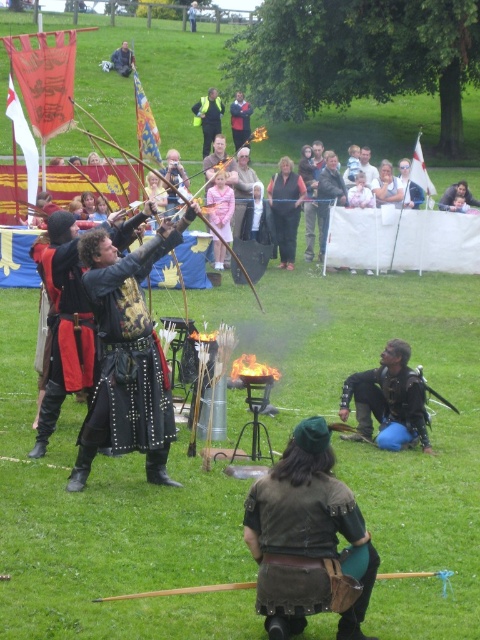
Question: Does yellow reflective vest at center have a larger size compared to smooth leather jacket at upper center?

Choices:
 (A) no
 (B) yes

Answer: (A)

Question: Does black leather armor at center appear over yellow reflective vest at center?

Choices:
 (A) no
 (B) yes

Answer: (A)

Question: Is dark brown leather jacket at center above smooth leather jacket at upper center?

Choices:
 (A) no
 (B) yes

Answer: (A)

Question: Among these points, which one is farthest from the camera?

Choices:
 (A) (455, 202)
 (B) (154, 408)

Answer: (A)

Question: Which object is positioned farthest from the leather jacket at upper center?

Choices:
 (A) dark brown leather jacket at center
 (B) smooth skin face at upper right
 (C) leather armor at center
 (D) yellow reflective vest at center

Answer: (C)

Question: Estimate the real-world distances between objects in this image. Which object is farther from the black leather armor at center?

Choices:
 (A) smooth leather jacket at upper center
 (B) dark brown leather jacket at center

Answer: (A)